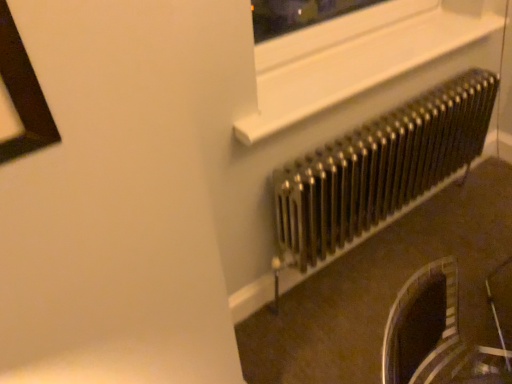
In order to click on vacant area situated below metallic radiator at right (from a real-world perspective) in this screenshot , I will do `click(378, 243)`.